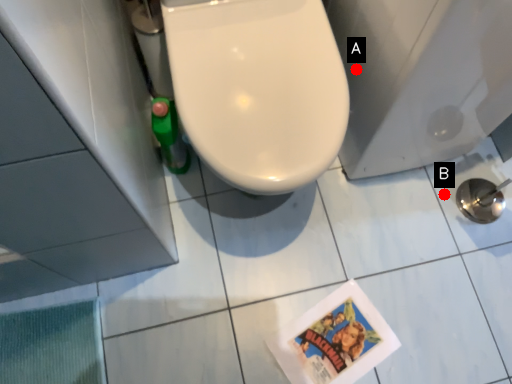
Question: Two points are circled on the image, labeled by A and B beside each circle. Which of the following is the closest to the observer?

Choices:
 (A) A is closer
 (B) B is closer

Answer: (A)